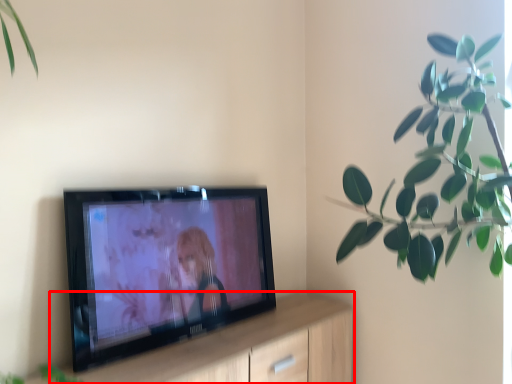
Question: From the image, what is the correct spatial relationship of dresser (annotated by the red box) in relation to houseplant?

Choices:
 (A) right
 (B) left

Answer: (B)